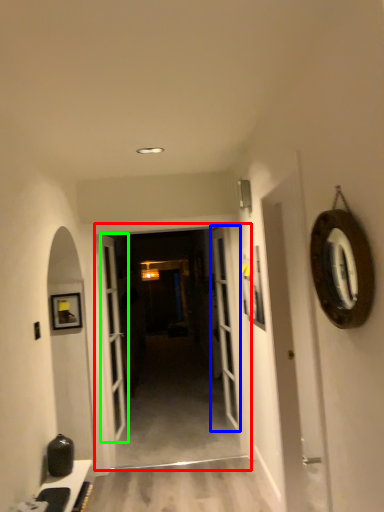
Question: Estimate the real-world distances between objects in this image. Which object is farther from garage door (highlighted by a red box), door (highlighted by a blue box) or door (highlighted by a green box)?

Choices:
 (A) door
 (B) door

Answer: (B)